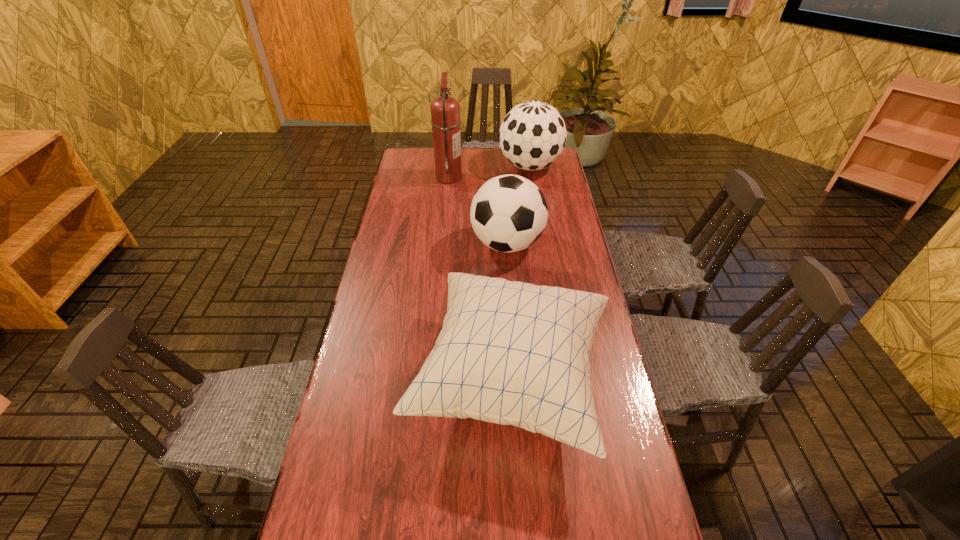
Identify the location of fire extinguisher. (445, 111).

Identify the location of the farther soccer ball. (532, 136).

Find the location of `the third farthest object`. the third farthest object is located at coordinates (508, 213).

Locate an element on the screen. Image resolution: width=960 pixels, height=540 pixels. the nearest object is located at coordinates (512, 353).

You are a GUI agent. You are given a task and a screenshot of the screen. Output one action in this format:
    pyautogui.click(x=<x>, y=<y>)
    Task: Click on the vacant space located on the front-facing side of the fire extinguisher
    This screenshot has height=540, width=960.
    Given the screenshot: What is the action you would take?
    pyautogui.click(x=478, y=177)

This screenshot has height=540, width=960. Identify the location of free space located 0.110m on the left of the farther soccer ball. (474, 166).

Locate an element on the screen. The width and height of the screenshot is (960, 540). free spot located on the right of the second nearest object is located at coordinates (565, 244).

Identify the location of vacant space located 0.050m on the front of the cushion. (517, 508).

The height and width of the screenshot is (540, 960). Find the location of `fire extinguisher located in the far edge section of the desktop`. fire extinguisher located in the far edge section of the desktop is located at coordinates (445, 111).

You are a GUI agent. You are given a task and a screenshot of the screen. Output one action in this format:
    pyautogui.click(x=<x>, y=<y>)
    Task: Click on the soccer ball that is positioned at the far edge
    Image resolution: width=960 pixels, height=540 pixels.
    Given the screenshot: What is the action you would take?
    pyautogui.click(x=532, y=136)